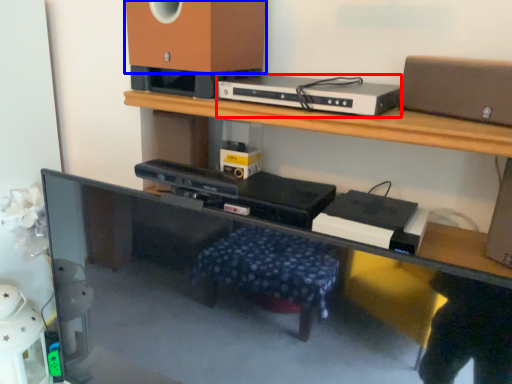
Question: Which object appears closest to the camera in this image, gadget (highlighted by a red box) or speaker (highlighted by a blue box)?

Choices:
 (A) gadget
 (B) speaker

Answer: (A)